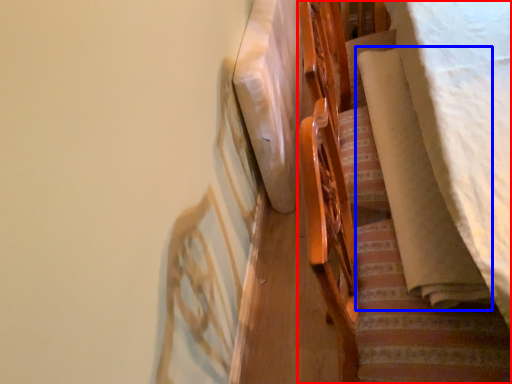
Question: Which object is further to the camera taking this photo, furniture (highlighted by a red box) or blanket (highlighted by a blue box)?

Choices:
 (A) furniture
 (B) blanket

Answer: (B)